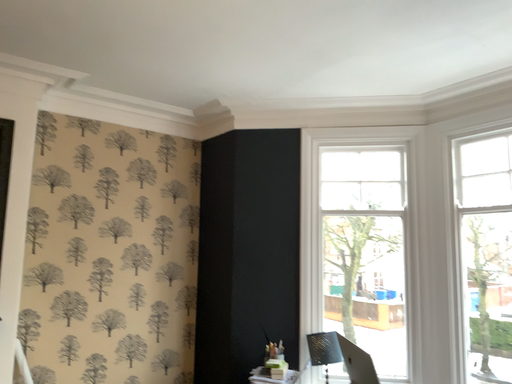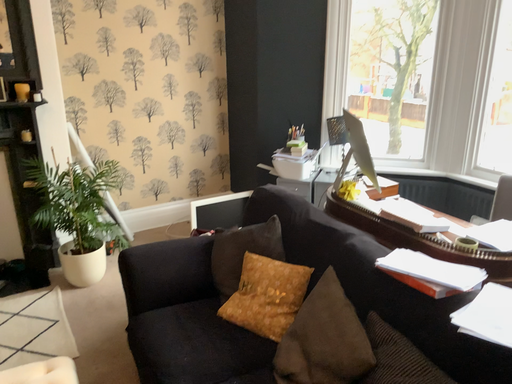
Question: How did the camera likely rotate when shooting the video?

Choices:
 (A) rotated left
 (B) rotated right

Answer: (A)